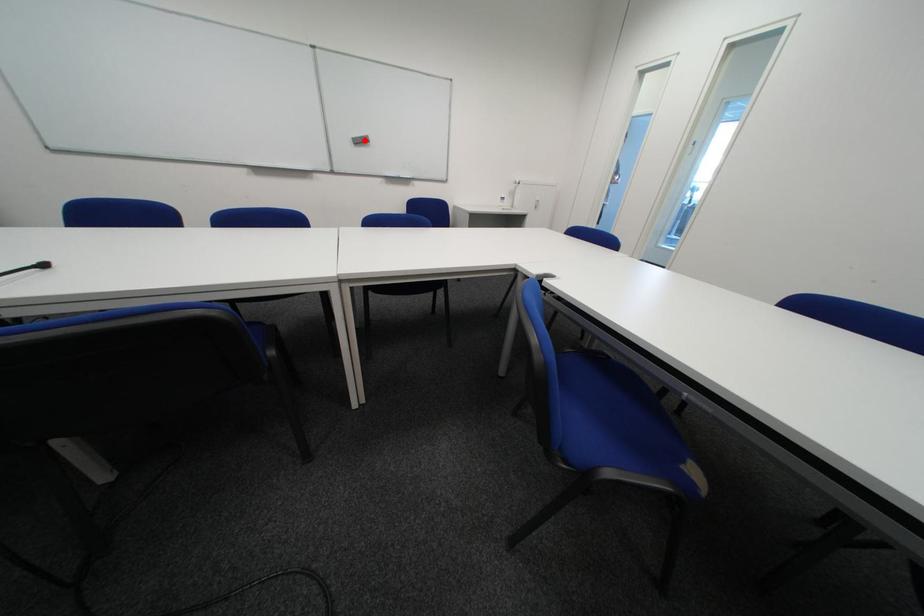
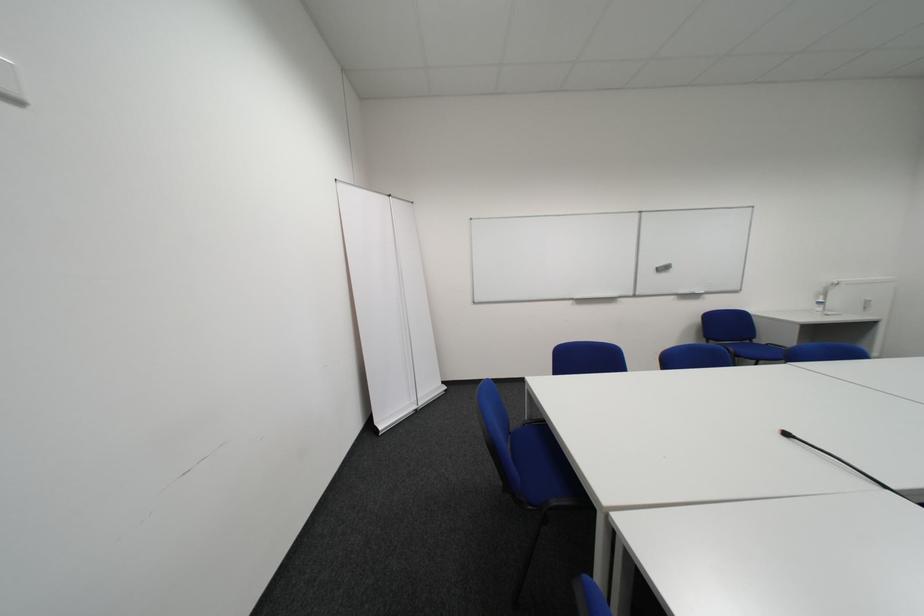
Question: A red point is marked in image1. In image2, is the corresponding 3D point closer to the camera or farther? Reply with the corresponding letter.

Choices:
 (A) The corresponding 3D point is closer.
 (B) The corresponding 3D point is farther.

Answer: (B)